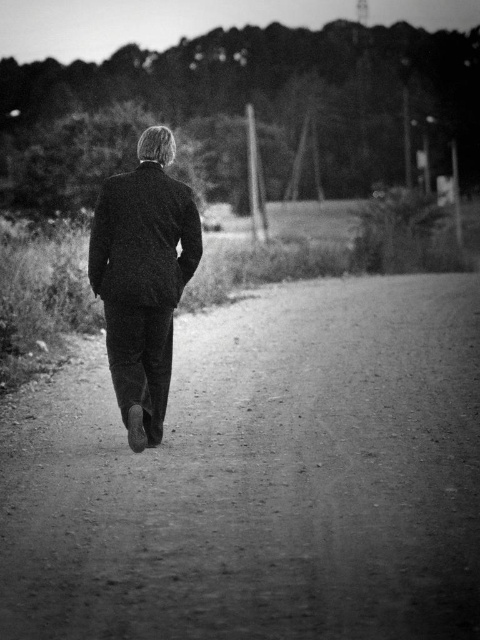
Question: Does dirt track at center lie in front of textured wool suit at center?

Choices:
 (A) no
 (B) yes

Answer: (B)

Question: Which object appears closest to the camera in this image?

Choices:
 (A) dirt track at center
 (B) textured wool suit at center

Answer: (A)

Question: Where is dirt track at center located in relation to textured wool suit at center in the image?

Choices:
 (A) above
 (B) below

Answer: (B)

Question: Can you confirm if dirt track at center is smaller than textured wool suit at center?

Choices:
 (A) yes
 (B) no

Answer: (B)

Question: Which object is closer to the camera taking this photo?

Choices:
 (A) dirt track at center
 (B) textured wool suit at center

Answer: (A)